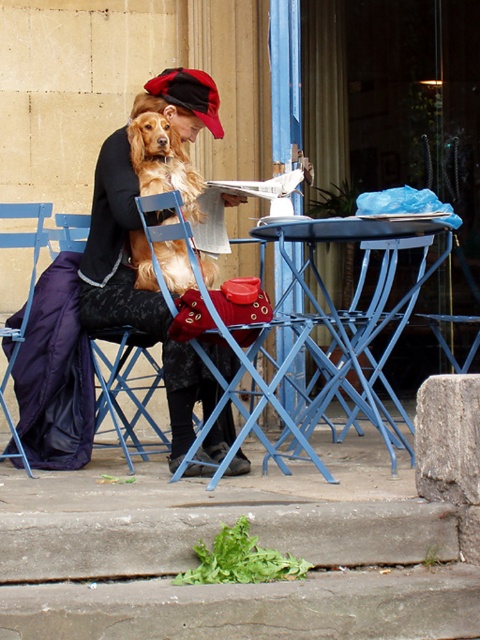
You are a customer at the outdoor cafe and want to place your coffee cup on the table. Can you put it on the blue metal table at center without it being in the way of the golden fur dog at center?

The blue metal table at center is located below the golden fur dog at center, so placing the coffee cup on the blue metal table at center should not interfere with the dog as it is positioned lower.

You are a delivery person who needs to place a small package between the golden fur dog at center and the blue metal chair at left. Can you fit the package in the space between them if the package is 20 inches long?

The golden fur dog at center is 23.09 inches from blue metal chair at left. Since the package is 20 inches long, it can fit in the space between them as the distance is greater than the package length.